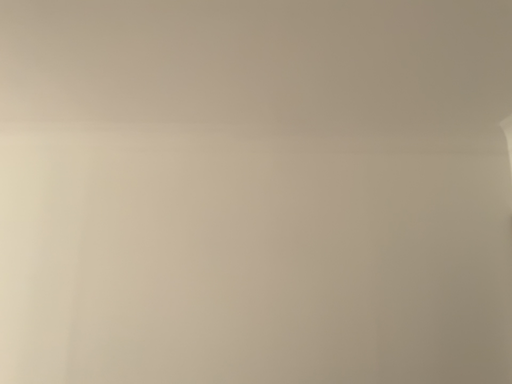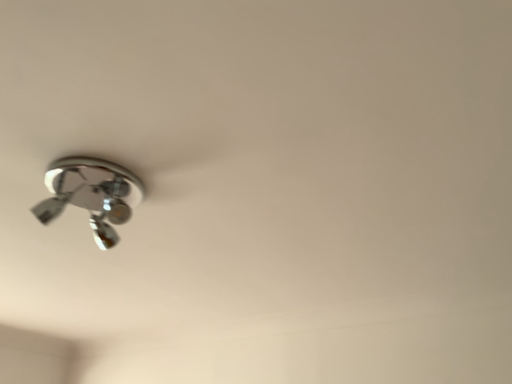
Question: How did the camera likely rotate when shooting the video?

Choices:
 (A) rotated left
 (B) rotated right

Answer: (A)